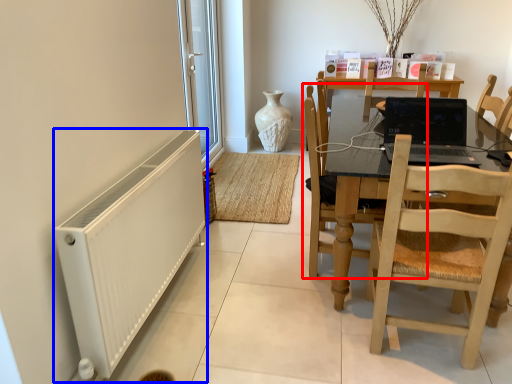
Question: Among these objects, which one is nearest to the camera, chair (highlighted by a red box) or radiator (highlighted by a blue box)?

Choices:
 (A) chair
 (B) radiator

Answer: (B)